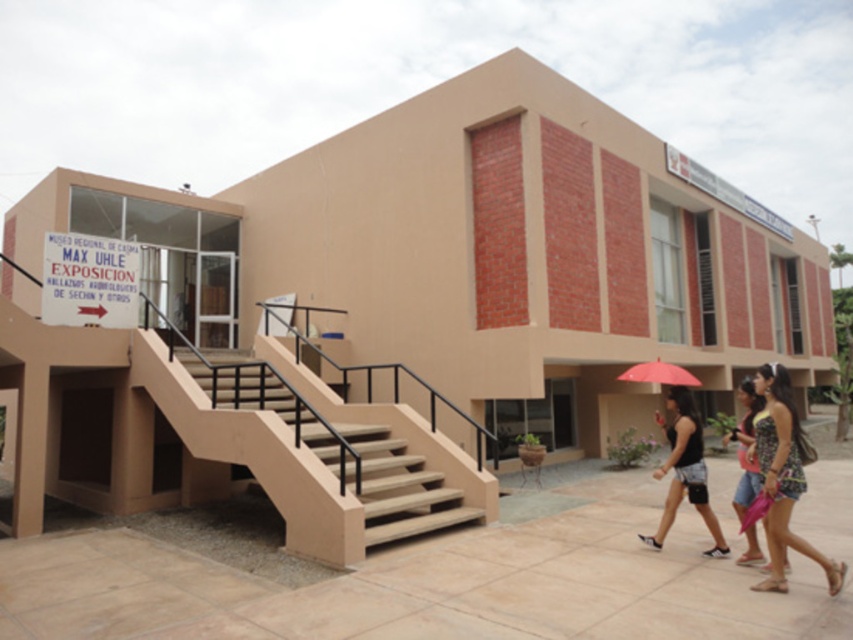
Question: Which point appears farthest from the camera in this image?

Choices:
 (A) (431, 518)
 (B) (50, 273)
 (C) (728, 432)

Answer: (C)

Question: Which of the following is the closest to the observer?

Choices:
 (A) (107, 260)
 (B) (746, 442)
 (C) (682, 404)

Answer: (B)

Question: Does white paper sign at upper left have a smaller size compared to printed fabric dress at lower right?

Choices:
 (A) no
 (B) yes

Answer: (B)

Question: Which object appears closest to the camera in this image?

Choices:
 (A) printed fabric dress at lower right
 (B) matte red umbrella at center

Answer: (A)

Question: Does beige concrete stairs at center have a smaller size compared to floral strapless dress at lower right?

Choices:
 (A) no
 (B) yes

Answer: (A)

Question: Does beige concrete stairs at center appear over floral strapless dress at lower right?

Choices:
 (A) no
 (B) yes

Answer: (B)